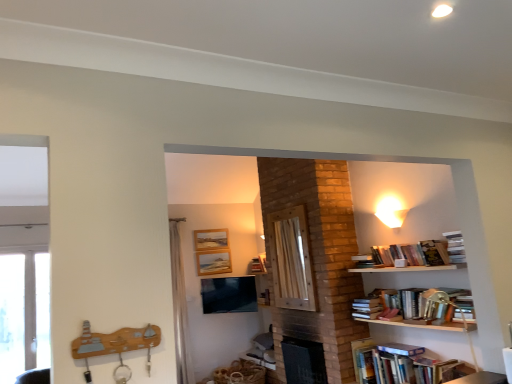
Question: Should I look upward or downward to see hardcover books at lower right, marked as the 2th book in a top-to-bottom arrangement?

Choices:
 (A) up
 (B) down

Answer: (B)

Question: Can you confirm if translucent fabric curtain at center is smaller than wooden picture frame at upper center, marked as the second picture frame in a top-to-bottom arrangement?

Choices:
 (A) yes
 (B) no

Answer: (B)

Question: Can you confirm if translucent fabric curtain at center is bigger than wooden picture frame at upper center, marked as the second picture frame in a top-to-bottom arrangement?

Choices:
 (A) yes
 (B) no

Answer: (A)

Question: Can you confirm if translucent fabric curtain at center is positioned to the left of wooden picture frame at upper center, the 1th picture frame in the bottom-to-top sequence?

Choices:
 (A) no
 (B) yes

Answer: (B)

Question: Can you confirm if translucent fabric curtain at center is thinner than wooden picture frame at upper center, the 1th picture frame in the bottom-to-top sequence?

Choices:
 (A) yes
 (B) no

Answer: (B)

Question: Is translucent fabric curtain at center further to camera compared to wooden picture frame at upper center, marked as the second picture frame in a top-to-bottom arrangement?

Choices:
 (A) yes
 (B) no

Answer: (B)

Question: From a real-world perspective, is translucent fabric curtain at center located beneath wooden picture frame at upper center, the 1th picture frame in the bottom-to-top sequence?

Choices:
 (A) yes
 (B) no

Answer: (A)

Question: Is wooden picture frame at upper center, positioned as the 2th picture frame in bottom-to-top order, touching hardcover books at lower right, marked as the 2th book in a top-to-bottom arrangement?

Choices:
 (A) yes
 (B) no

Answer: (B)

Question: From the image's perspective, is wooden picture frame at upper center, positioned as the 2th picture frame in bottom-to-top order, under hardcover books at lower right, marked as the 1th book in a bottom-to-top arrangement?

Choices:
 (A) yes
 (B) no

Answer: (B)

Question: Is wooden picture frame at upper center, positioned as the 2th picture frame in bottom-to-top order, further to camera compared to hardcover books at lower right, marked as the 2th book in a top-to-bottom arrangement?

Choices:
 (A) no
 (B) yes

Answer: (B)

Question: From a real-world perspective, is wooden picture frame at upper center, the first picture frame from the top, under hardcover books at lower right, marked as the 1th book in a bottom-to-top arrangement?

Choices:
 (A) yes
 (B) no

Answer: (B)

Question: Is wooden picture frame at upper center, the first picture frame from the top, oriented towards hardcover books at lower right, marked as the 1th book in a bottom-to-top arrangement?

Choices:
 (A) yes
 (B) no

Answer: (B)

Question: Is the depth of wooden picture frame at upper center, positioned as the 2th picture frame in bottom-to-top order, less than that of hardcover books at lower right, marked as the 1th book in a bottom-to-top arrangement?

Choices:
 (A) yes
 (B) no

Answer: (B)

Question: Is matte black tv at center turned away from hardcover books at lower right, marked as the 2th book in a top-to-bottom arrangement?

Choices:
 (A) yes
 (B) no

Answer: (B)